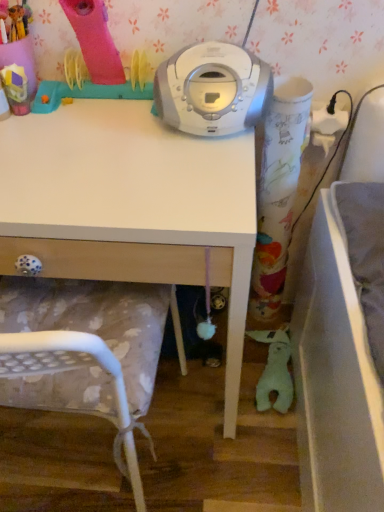
The height and width of the screenshot is (512, 384). What do you see at coordinates (80, 349) in the screenshot?
I see `white plastic chair at lower left` at bounding box center [80, 349].

The image size is (384, 512). What do you see at coordinates (16, 88) in the screenshot? I see `rubberized pink hairdryer at upper left, which is counted as the 1th toy, starting from the front` at bounding box center [16, 88].

Identify the location of green plush toy at lower right, acting as the 2th toy starting from the front. The width and height of the screenshot is (384, 512). (274, 370).

This screenshot has height=512, width=384. Find the location of `home appliance that is on the right side of rubberized pink hairdryer at upper left, the 2th toy in the bottom-to-top sequence`. home appliance that is on the right side of rubberized pink hairdryer at upper left, the 2th toy in the bottom-to-top sequence is located at coordinates (212, 89).

Does rubberized pink hairdryer at upper left, the 2th toy in the bottom-to-top sequence, turn towards white plastic cd player at center?

No.

From the image's perspective, between rubberized pink hairdryer at upper left, marked as the second toy in a back-to-front arrangement, and white plastic cd player at center, who is located below?

rubberized pink hairdryer at upper left, marked as the second toy in a back-to-front arrangement, from the image's perspective.

Measure the distance from rubberized pink hairdryer at upper left, which is the second toy from right to left, to white plastic cd player at center.

rubberized pink hairdryer at upper left, which is the second toy from right to left, and white plastic cd player at center are 15.32 inches apart from each other.

From the image's perspective, which is above, white matte desk at center or white plastic chair at lower left?

white matte desk at center appears higher in the image.

Does white matte desk at center have a greater height compared to white plastic chair at lower left?

Incorrect, the height of white matte desk at center is not larger of that of white plastic chair at lower left.

From the picture: Does white matte desk at center touch white plastic chair at lower left?

white matte desk at center is not next to white plastic chair at lower left, and they're not touching.

Is white matte desk at center completely or partially outside of green plush toy at lower right, acting as the 2th toy starting from the front?

Yes, white matte desk at center is not within green plush toy at lower right, acting as the 2th toy starting from the front.

Can you confirm if white matte desk at center is bigger than green plush toy at lower right, acting as the 2th toy starting from the front?

Correct, white matte desk at center is larger in size than green plush toy at lower right, acting as the 2th toy starting from the front.

Does point (21, 148) appear closer or farther from the camera than point (287, 332)?

Clearly, point (21, 148) is closer to the camera than point (287, 332).

From a real-world perspective, between white plastic chair at lower left and rubberized pink hairdryer at upper left, which is counted as the 1th toy, starting from the front, who is vertically lower?

white plastic chair at lower left is physically lower.

From the image's perspective, which one is positioned higher, white plastic chair at lower left or rubberized pink hairdryer at upper left, positioned as the 1th toy in top-to-bottom order?

rubberized pink hairdryer at upper left, positioned as the 1th toy in top-to-bottom order, is shown above in the image.

Consider the image. Considering the sizes of white plastic chair at lower left and rubberized pink hairdryer at upper left, the 2th toy in the bottom-to-top sequence, in the image, is white plastic chair at lower left taller or shorter than rubberized pink hairdryer at upper left, the 2th toy in the bottom-to-top sequence,?

Clearly, white plastic chair at lower left is taller compared to rubberized pink hairdryer at upper left, the 2th toy in the bottom-to-top sequence.

Does point (3, 328) lie in front of point (20, 99)?

Yes, point (3, 328) is closer to viewer.

Who is smaller, white plastic chair at lower left or white plastic cd player at center?

white plastic cd player at center is smaller.

From a real-world perspective, relative to white plastic cd player at center, is white plastic chair at lower left vertically above or below?

From a real-world perspective, white plastic chair at lower left is physically below white plastic cd player at center.

Considering the sizes of objects white plastic chair at lower left and white plastic cd player at center in the image provided, who is thinner, white plastic chair at lower left or white plastic cd player at center?

With smaller width is white plastic cd player at center.

Considering the relative sizes of white plastic chair at lower left and white plastic cd player at center in the image provided, is white plastic chair at lower left shorter than white plastic cd player at center?

No.

Does white matte desk at center appear on the left side of rubberized pink hairdryer at upper left, the 2th toy in the bottom-to-top sequence?

No, white matte desk at center is not to the left of rubberized pink hairdryer at upper left, the 2th toy in the bottom-to-top sequence.

Between point (113, 218) and point (23, 75), which one is positioned behind?

Positioned behind is point (23, 75).

At what (x,y) coordinates should I click in order to perform the action: click on toy above the white matte desk at center (from a real-world perspective). Please return your answer as a coordinate pair (x, y). Looking at the image, I should click on (16, 88).

Which is closer, (261, 339) or (192, 147)?

Clearly, point (261, 339) is more distant from the camera than point (192, 147).

From a real-world perspective, is green plush toy at lower right, acting as the 2th toy starting from the front, over white matte desk at center?

No, from a real-world perspective, green plush toy at lower right, acting as the 2th toy starting from the front, is not above white matte desk at center.

Which is in front, green plush toy at lower right, which ranks as the 2th toy in top-to-bottom order, or white matte desk at center?

white matte desk at center.

Is green plush toy at lower right, acting as the 2th toy starting from the front, bigger or smaller than white matte desk at center?

In the image, green plush toy at lower right, acting as the 2th toy starting from the front, appears to be smaller than white matte desk at center.

Identify the location of toy that appears on the left of white plastic cd player at center. (16, 88).

The image size is (384, 512). What are the coordinates of `chair below the white matte desk at center (from the image's perspective)` in the screenshot? It's located at (80, 349).

Based on the photo, when comparing their distances from white matte desk at center, does rubberized pink hairdryer at upper left, the 2th toy in the bottom-to-top sequence, or white plastic chair at lower left seem further?

rubberized pink hairdryer at upper left, the 2th toy in the bottom-to-top sequence, is positioned further to the anchor white matte desk at center.

Considering their positions, is white matte desk at center positioned further to white plastic chair at lower left than green plush toy at lower right, the 2th toy when ordered from left to right?

green plush toy at lower right, the 2th toy when ordered from left to right, lies further to white plastic chair at lower left than the other object.

In the scene shown: When comparing their distances from white plastic cd player at center, does white matte desk at center or white plastic chair at lower left seem further?

white plastic chair at lower left lies further to white plastic cd player at center than the other object.

When comparing their distances from white matte desk at center, does green plush toy at lower right, which ranks as the 2th toy in top-to-bottom order, or white plastic cd player at center seem closer?

Among the two, white plastic cd player at center is located nearer to white matte desk at center.

From the image, which object appears to be nearer to white plastic cd player at center, rubberized pink hairdryer at upper left, the 2th toy in the bottom-to-top sequence, or white matte desk at center?

white matte desk at center.

When comparing their distances from green plush toy at lower right, the 2th toy when ordered from left to right, does white matte desk at center or white plastic chair at lower left seem further?

white matte desk at center.

From the image, which object appears to be farther from white plastic cd player at center, green plush toy at lower right, acting as the 2th toy starting from the front, or white matte desk at center?

green plush toy at lower right, acting as the 2th toy starting from the front.

Which object lies further to the anchor point white plastic chair at lower left, green plush toy at lower right, the 1th toy viewed from the back, or white matte desk at center?

Based on the image, green plush toy at lower right, the 1th toy viewed from the back, appears to be further to white plastic chair at lower left.

The width and height of the screenshot is (384, 512). Find the location of `toy between white plastic chair at lower left and green plush toy at lower right, arranged as the first toy when ordered from the bottom, along the z-axis`. toy between white plastic chair at lower left and green plush toy at lower right, arranged as the first toy when ordered from the bottom, along the z-axis is located at coordinates (16, 88).

What are the coordinates of `desk between rubberized pink hairdryer at upper left, positioned as the 1th toy in top-to-bottom order, and green plush toy at lower right, acting as the 1th toy starting from the right, in the horizontal direction` in the screenshot? It's located at (131, 206).

Locate an element on the screen. The height and width of the screenshot is (512, 384). toy between white plastic cd player at center and green plush toy at lower right, acting as the 2th toy starting from the front, from top to bottom is located at coordinates pyautogui.click(x=16, y=88).

Identify the location of desk between white plastic chair at lower left and green plush toy at lower right, arranged as the first toy when ordered from the bottom, in the front-back direction. The image size is (384, 512). (131, 206).